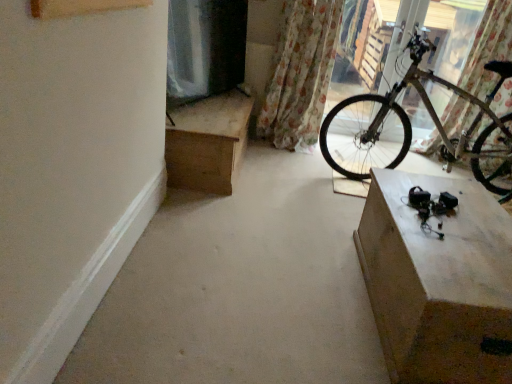
Locate an element on the screen. The image size is (512, 384). free space above white smooth baseboard at lower left (from a real-world perspective) is located at coordinates (109, 236).